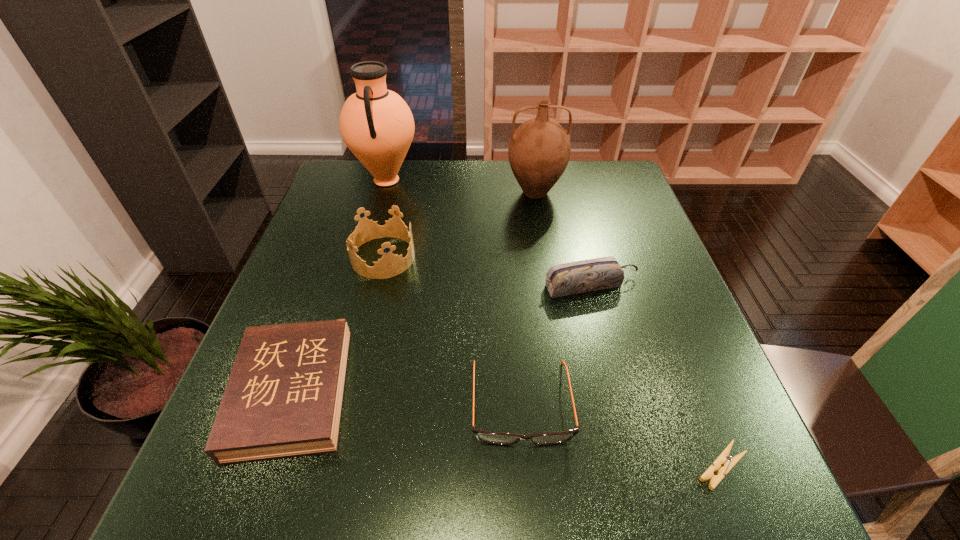
Identify the location of pencil box at the right edge. The height and width of the screenshot is (540, 960). (582, 276).

Find the location of a particular element. The width and height of the screenshot is (960, 540). clothespin situated at the right edge is located at coordinates (724, 457).

Find the location of a particular element. The image size is (960, 540). object that is at the far left corner is located at coordinates (376, 124).

This screenshot has width=960, height=540. What are the coordinates of `object present at the near left corner` in the screenshot? It's located at (284, 396).

Where is `object that is at the near right corner`? The height and width of the screenshot is (540, 960). object that is at the near right corner is located at coordinates (724, 457).

The height and width of the screenshot is (540, 960). In order to click on free space at the far edge of the desktop in this screenshot , I will do `click(549, 195)`.

You are a GUI agent. You are given a task and a screenshot of the screen. Output one action in this format:
    pyautogui.click(x=<x>, y=<y>)
    Task: Click on the blank space at the near edge of the desktop
    This screenshot has height=540, width=960.
    Given the screenshot: What is the action you would take?
    pyautogui.click(x=373, y=496)

In the image, there is a desktop. At what (x,y) coordinates should I click in order to perform the action: click on vacant space at the left edge. Please return your answer as a coordinate pair (x, y). Looking at the image, I should click on (311, 293).

Locate an element on the screen. The height and width of the screenshot is (540, 960). vacant space at the right edge of the desktop is located at coordinates (622, 247).

Locate an element on the screen. The image size is (960, 540). vacant space at the far right corner of the desktop is located at coordinates (584, 182).